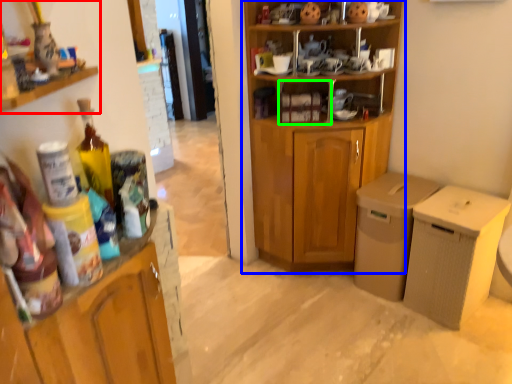
Question: Based on their relative distances, which object is nearer to cabinetry (highlighted by a red box)? Choose from cupboard (highlighted by a blue box) and cabinet (highlighted by a green box).

Choices:
 (A) cupboard
 (B) cabinet

Answer: (B)